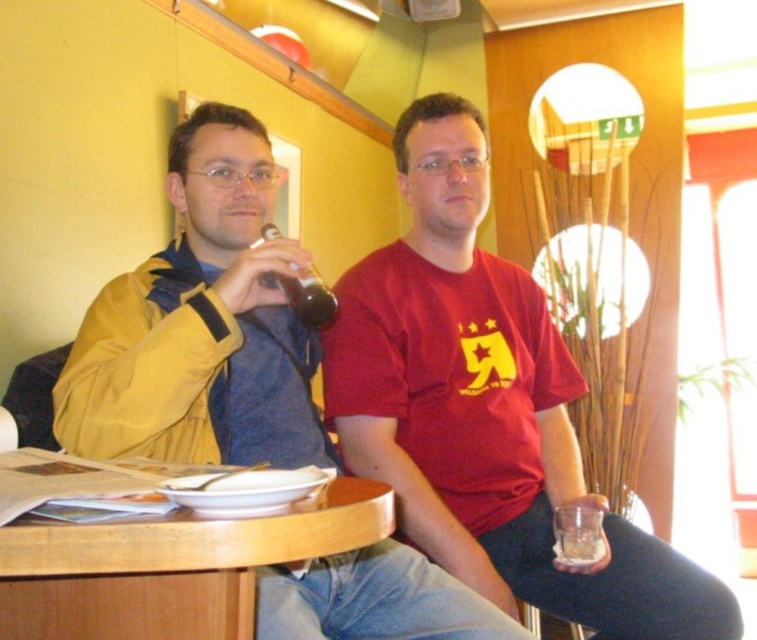
Question: Considering the real-world distances, which object is closest to the matte glass bottle at center?

Choices:
 (A) red matte t-shirt at center
 (B) yellow matte jacket at left
 (C) wooden table at center

Answer: (B)

Question: Can you confirm if yellow matte jacket at left is smaller than matte glass bottle at center?

Choices:
 (A) yes
 (B) no

Answer: (B)

Question: Is wooden table at center behind matte glass bottle at center?

Choices:
 (A) no
 (B) yes

Answer: (A)

Question: Among these points, which one is nearest to the camera?

Choices:
 (A) (260, 234)
 (B) (416, 620)

Answer: (B)

Question: Which is nearer to the red matte t-shirt at center?

Choices:
 (A) wooden table at center
 (B) yellow matte jacket at left

Answer: (B)

Question: Can you confirm if wooden table at center is smaller than matte glass bottle at center?

Choices:
 (A) no
 (B) yes

Answer: (A)